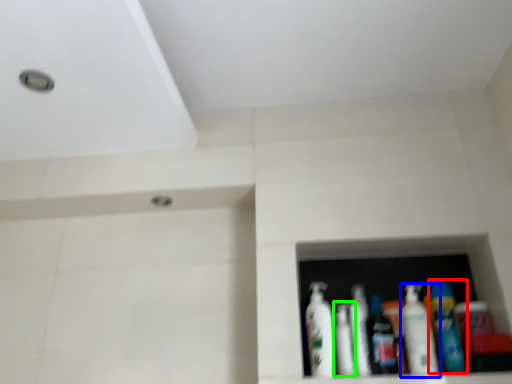
Question: Which object is positioned farthest from bottle (highlighted by a red box)? Select from bottle (highlighted by a blue box) and mouthwash (highlighted by a green box).

Choices:
 (A) bottle
 (B) mouthwash

Answer: (B)